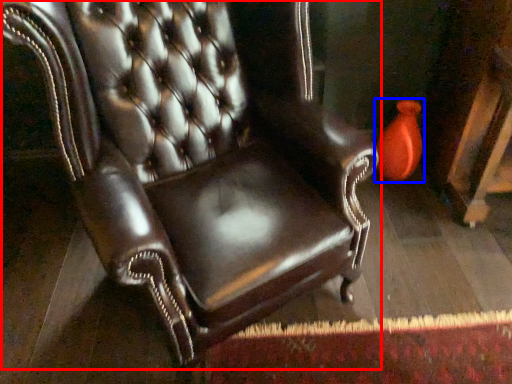
Question: Which object is closer to the camera taking this photo, chair (highlighted by a red box) or vase (highlighted by a blue box)?

Choices:
 (A) chair
 (B) vase

Answer: (A)